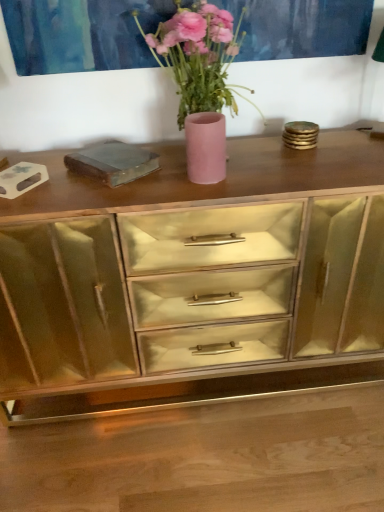
Question: From a real-world perspective, is matte pink vase at center physically located above or below pink matte vase at center?

Choices:
 (A) above
 (B) below

Answer: (B)

Question: From their relative heights in the image, would you say matte pink vase at center is taller or shorter than pink matte vase at center?

Choices:
 (A) short
 (B) tall

Answer: (A)

Question: Which object is the farthest from the gold mirrored cabinet at center?

Choices:
 (A) matte pink vase at center
 (B) pink matte vase at center

Answer: (B)

Question: Estimate the real-world distances between objects in this image. Which object is closer to the gold mirrored cabinet at center?

Choices:
 (A) pink matte vase at center
 (B) matte pink vase at center

Answer: (B)